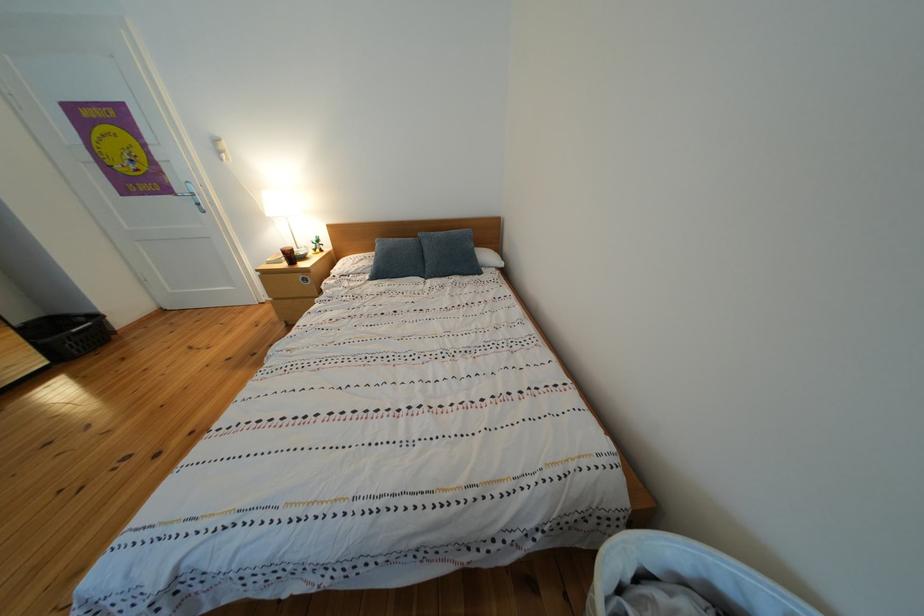
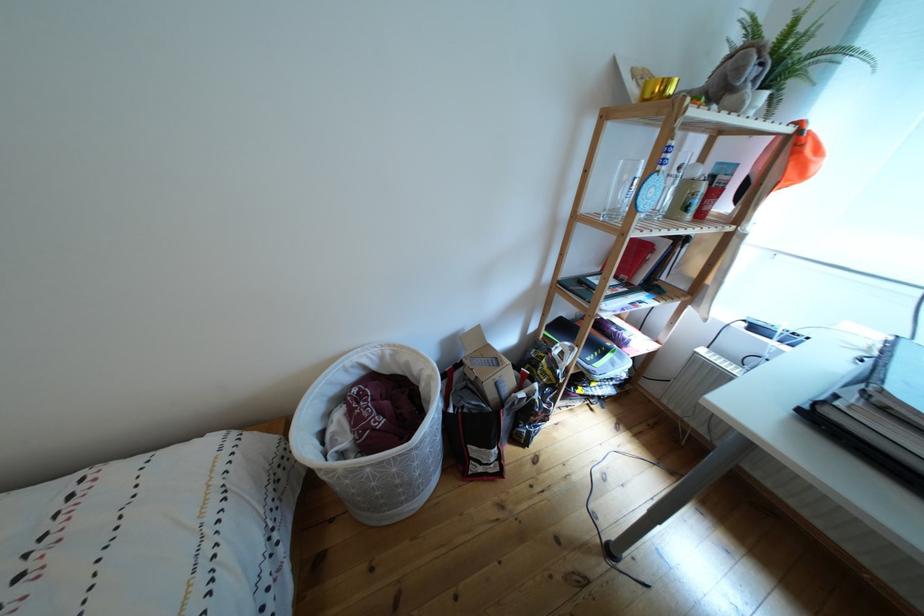
The point at (563, 390) is marked in the first image. Where is the corresponding point in the second image?

(70, 512)